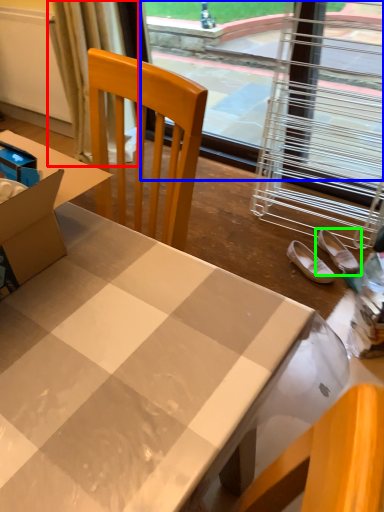
Question: Which is farther away from curtain (highlighted by a red box)? window screen (highlighted by a blue box) or footwear (highlighted by a green box)?

Choices:
 (A) window screen
 (B) footwear

Answer: (B)